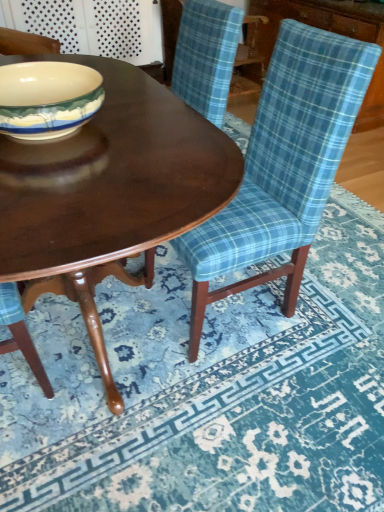
Find the location of `free location above blue plaid fabric at lower right (from a real-world perspective)`. free location above blue plaid fabric at lower right (from a real-world perspective) is located at coordinates (231, 360).